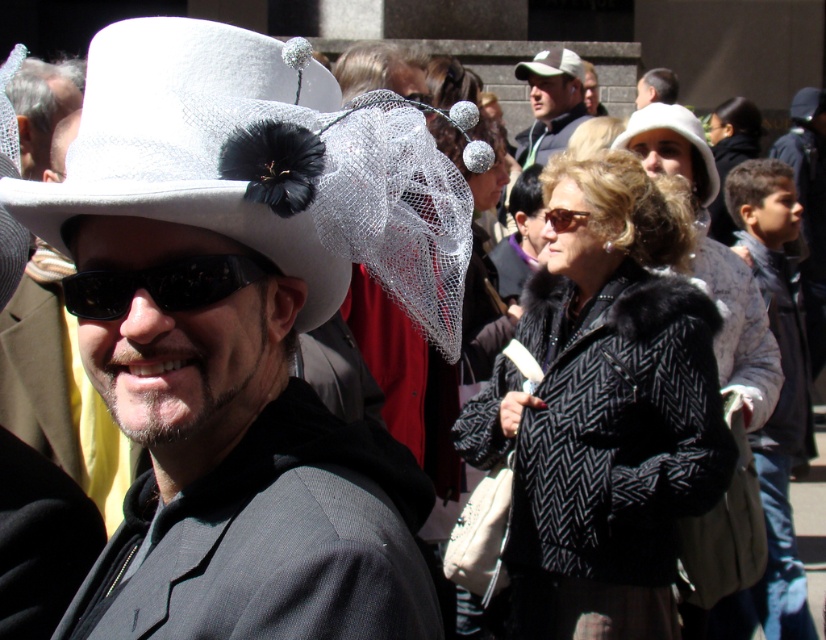
Question: Which point appears farthest from the camera in this image?

Choices:
 (A) (568, 592)
 (B) (635, 90)

Answer: (B)

Question: Is white fabric hat at upper center to the left of matte brown sunglasses at center from the viewer's perspective?

Choices:
 (A) yes
 (B) no

Answer: (B)

Question: Is black plastic sunglasses at center in front of white fabric hat at upper center?

Choices:
 (A) yes
 (B) no

Answer: (A)

Question: Among these objects, which one is farthest from the camera?

Choices:
 (A) khaki fabric cap at upper center
 (B) black herringbone coat at center

Answer: (A)

Question: Can you confirm if khaki fabric cap at upper center is bigger than dark brown hair at upper center?

Choices:
 (A) no
 (B) yes

Answer: (A)

Question: Which point is closer to the camera taking this photo?

Choices:
 (A) (597, 396)
 (B) (587, 212)

Answer: (A)